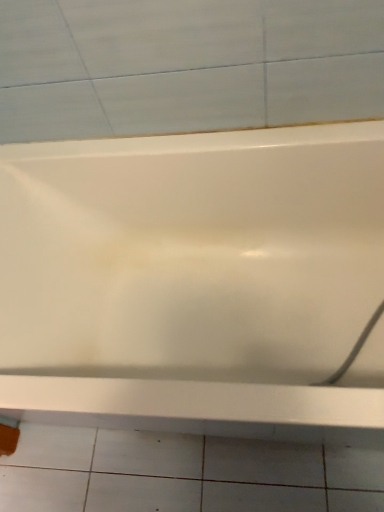
Question: Is white glossy bathtub at center not inside white glossy ceramic tile at lower center?

Choices:
 (A) no
 (B) yes

Answer: (B)

Question: Considering the relative sizes of white glossy bathtub at center and white glossy ceramic tile at lower center in the image provided, is white glossy bathtub at center bigger than white glossy ceramic tile at lower center?

Choices:
 (A) no
 (B) yes

Answer: (B)

Question: Can you confirm if white glossy bathtub at center is smaller than white glossy ceramic tile at lower center?

Choices:
 (A) yes
 (B) no

Answer: (B)

Question: From a real-world perspective, is white glossy bathtub at center over white glossy ceramic tile at lower center?

Choices:
 (A) no
 (B) yes

Answer: (B)

Question: Is white glossy bathtub at center positioned before white glossy ceramic tile at lower center?

Choices:
 (A) no
 (B) yes

Answer: (B)

Question: Considering the relative sizes of white glossy bathtub at center and white glossy ceramic tile at lower center in the image provided, is white glossy bathtub at center wider than white glossy ceramic tile at lower center?

Choices:
 (A) no
 (B) yes

Answer: (A)

Question: Can you confirm if white glossy ceramic tile at lower center is positioned to the right of white glossy bathtub at center?

Choices:
 (A) yes
 (B) no

Answer: (B)

Question: Is white glossy bathtub at center a part of white glossy ceramic tile at lower center?

Choices:
 (A) no
 (B) yes

Answer: (A)

Question: Does white glossy ceramic tile at lower center have a greater width compared to white glossy bathtub at center?

Choices:
 (A) yes
 (B) no

Answer: (A)

Question: Is there a large distance between white glossy ceramic tile at lower center and white glossy bathtub at center?

Choices:
 (A) yes
 (B) no

Answer: (B)

Question: Is white glossy ceramic tile at lower center aimed at white glossy bathtub at center?

Choices:
 (A) no
 (B) yes

Answer: (A)

Question: Is white glossy ceramic tile at lower center to the left of white glossy bathtub at center from the viewer's perspective?

Choices:
 (A) no
 (B) yes

Answer: (B)

Question: In terms of size, does white glossy bathtub at center appear bigger or smaller than white glossy ceramic tile at lower center?

Choices:
 (A) small
 (B) big

Answer: (B)